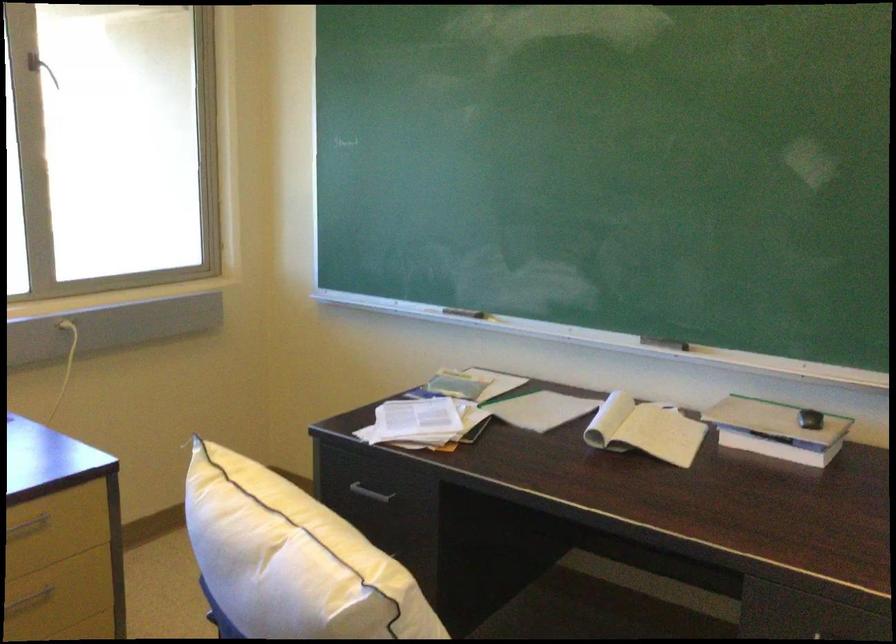
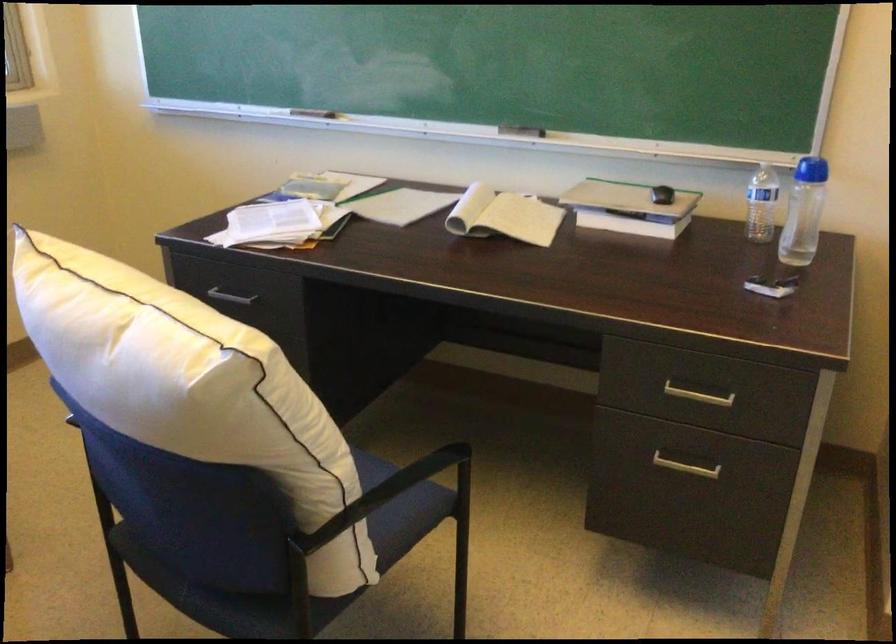
Question: The images are taken continuously from a first-person perspective. In which direction is your viewpoint rotating?

Choices:
 (A) Left
 (B) Right
 (C) Up
 (D) Down

Answer: (D)